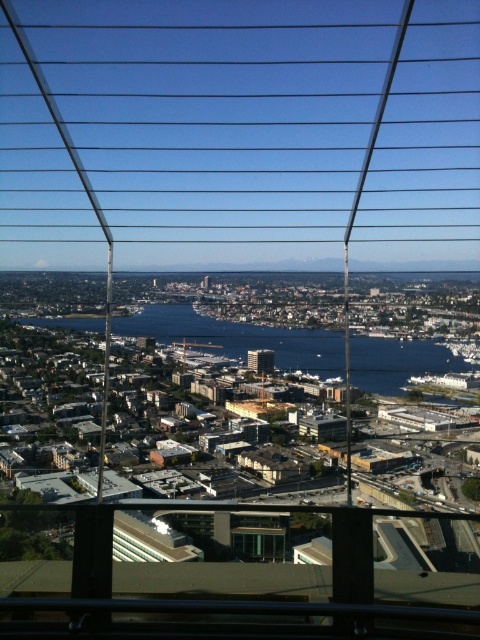
What do you see at coordinates (259, 544) in the screenshot?
I see `transparent glass window at center` at bounding box center [259, 544].

Does transparent glass window at center appear on the left side of clear glass window at center?

In fact, transparent glass window at center is to the right of clear glass window at center.

I want to click on transparent glass window at center, so click(259, 544).

Is blue water at center thinner than transparent glass window at center?

Incorrect, blue water at center's width is not less than transparent glass window at center's.

What do you see at coordinates (240, 337) in the screenshot?
I see `blue water at center` at bounding box center [240, 337].

Between point (407, 365) and point (274, 529), which one is positioned in front?

Positioned in front is point (407, 365).

Find the location of a particular element. This screenshot has width=480, height=640. blue water at center is located at coordinates (240, 337).

Does blue water at center appear under clear glass window at center?

Incorrect, blue water at center is not positioned below clear glass window at center.

Does point (406, 348) come farther from viewer compared to point (112, 557)?

Yes.

The width and height of the screenshot is (480, 640). Identify the location of blue water at center. (240, 337).